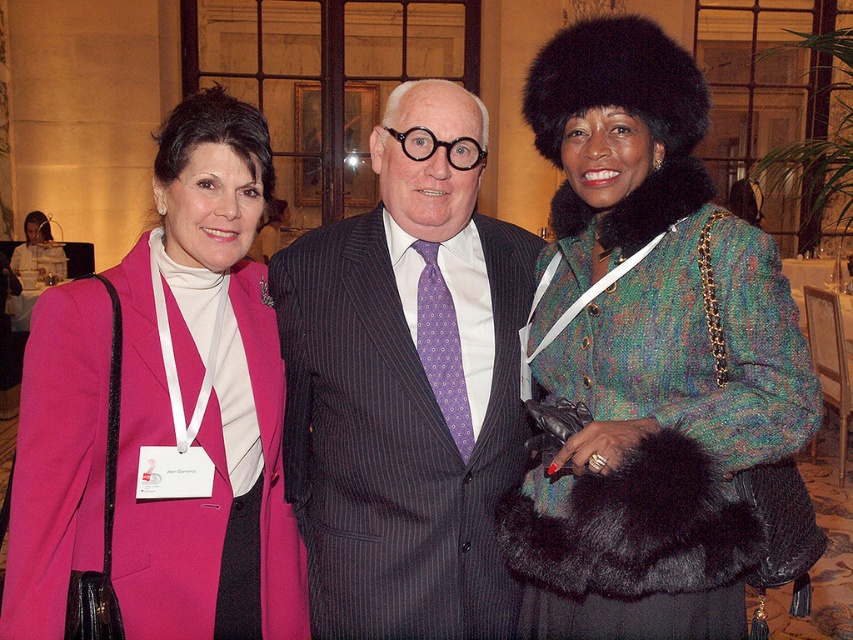
In the scene described, there are two people wearing the matte pink coat at center and the purple pinstriped suit at center. Which one is positioned to the left?

The matte pink coat at center is positioned to the left of the purple pinstriped suit at center.

You are standing in front of the group of three people at the formal event. You notice two points marked in the image. The first point is at coordinate point (641, 28) and the second is at point (164, 172). Which of these points is nearer to you?

Point (641, 28) is closer to the viewer than point (164, 172).